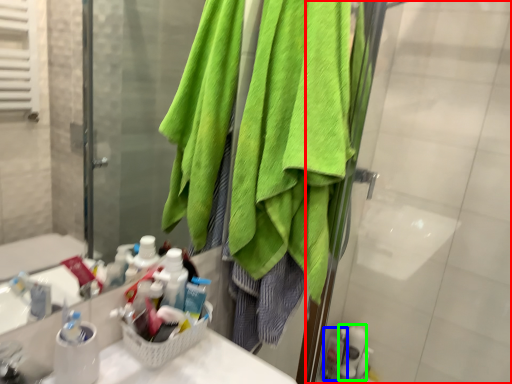
Question: Estimate the real-world distances between objects in this image. Which object is closer to screen door (highlighted by a red box), toiletry (highlighted by a blue box) or toiletry (highlighted by a green box)?

Choices:
 (A) toiletry
 (B) toiletry

Answer: (B)